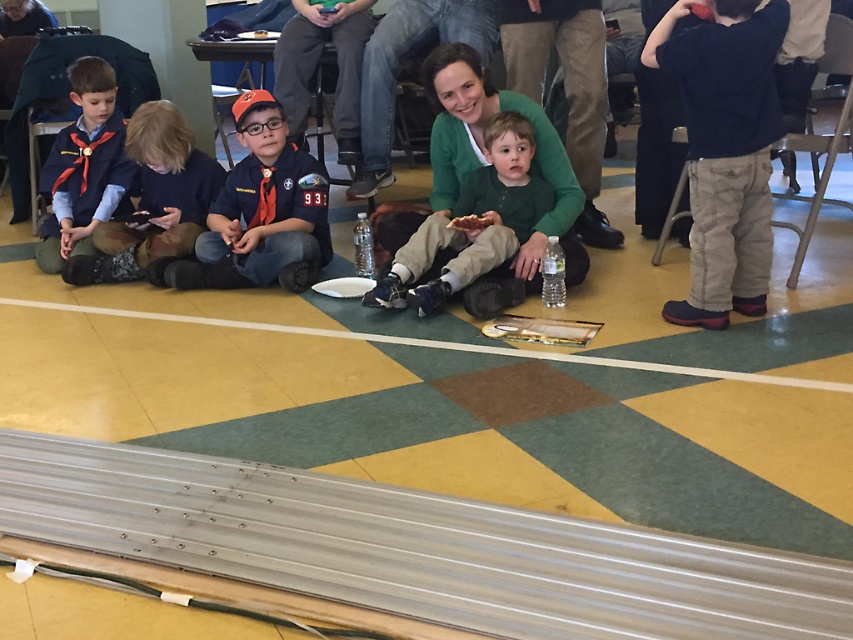
Question: Estimate the real-world distances between objects in this image. Which object is closer to the brown crumbly bread at center?

Choices:
 (A) green cotton shirt at center
 (B) dark blue sweater at upper right
 (C) matte blue shirt at lower left
 (D) matte orange cap at center

Answer: (A)

Question: Which object appears closest to the camera in this image?

Choices:
 (A) brown crumbly bread at center
 (B) matte orange cap at center
 (C) green cotton shirt at center
 (D) dark blue sweater at upper right

Answer: (D)

Question: Which point is closer to the camera taking this photo?

Choices:
 (A) (405, 243)
 (B) (297, 186)

Answer: (A)

Question: Is dark blue sweater at upper right below matte orange cap at center?

Choices:
 (A) no
 (B) yes

Answer: (A)

Question: Is green cotton shirt at center positioned in front of matte blue uniform at left?

Choices:
 (A) yes
 (B) no

Answer: (A)

Question: Does matte blue shirt at lower left come behind matte blue uniform at left?

Choices:
 (A) yes
 (B) no

Answer: (B)